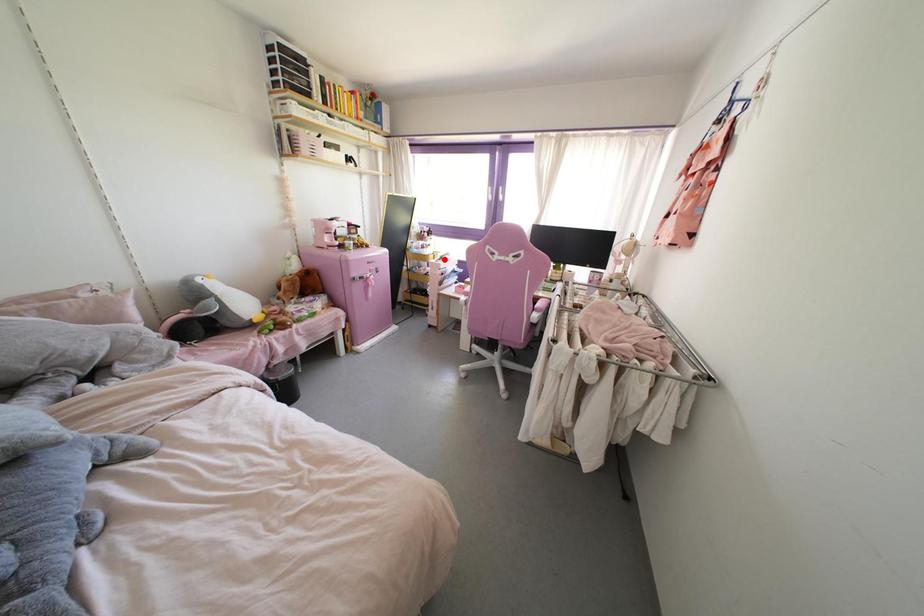
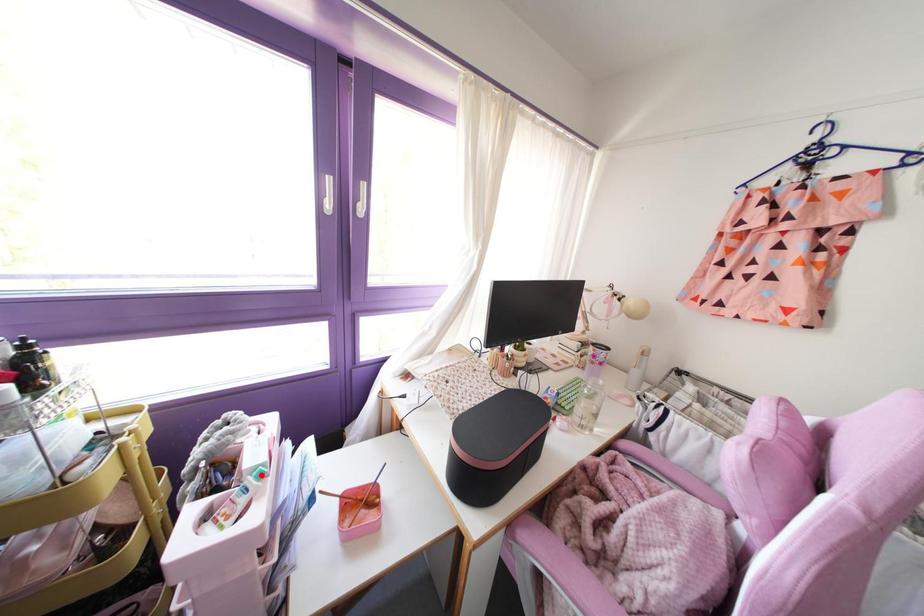
I am providing you with two images of the same scene from different viewpoints. A red point is marked on the first image and another point is marked on the second image. Does the point marked in image1 correspond to the same location as the one in image2?

Yes